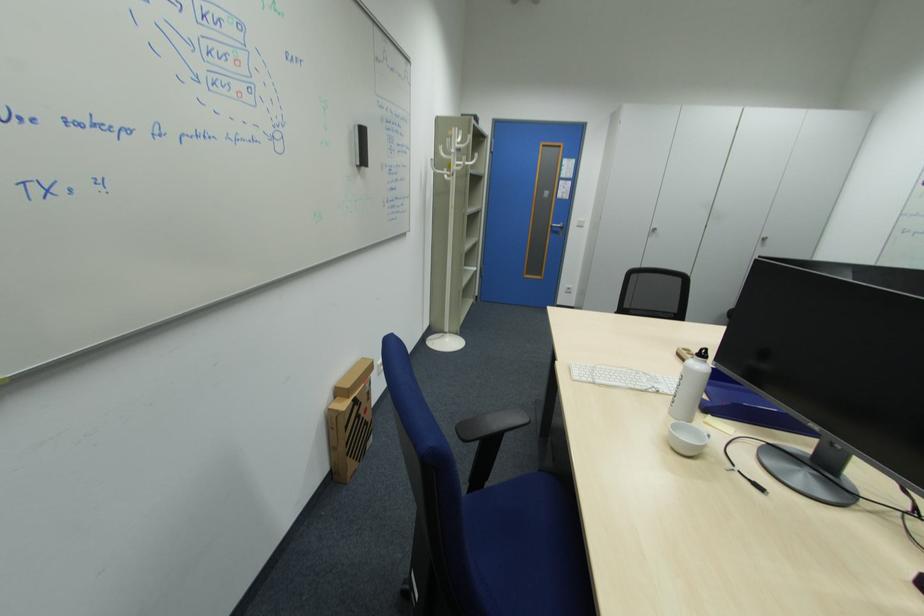
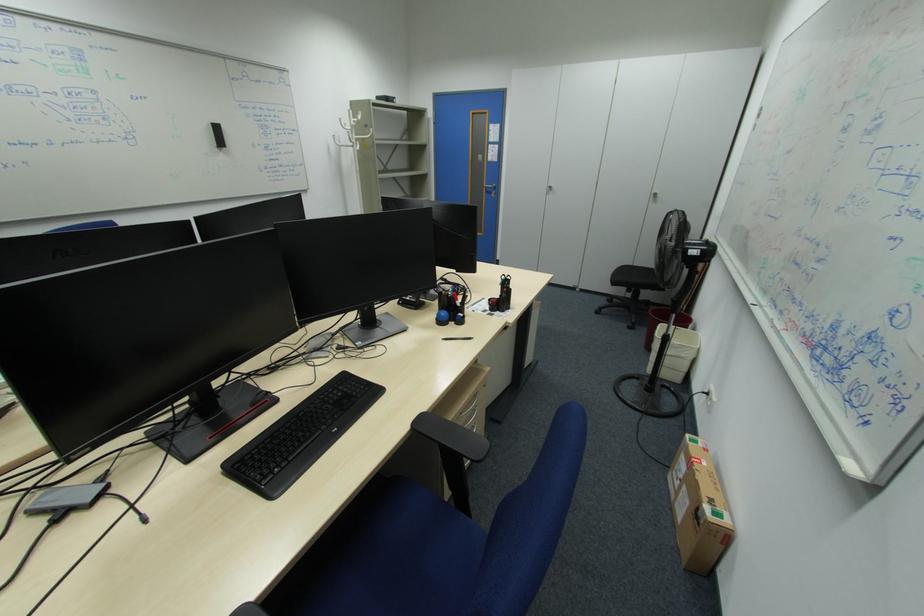
Question: Which direction would the cameraman need to move to produce the second image? Reply with the corresponding letter.

Choices:
 (A) Left
 (B) Right
 (C) Forward
 (D) Backward

Answer: (B)